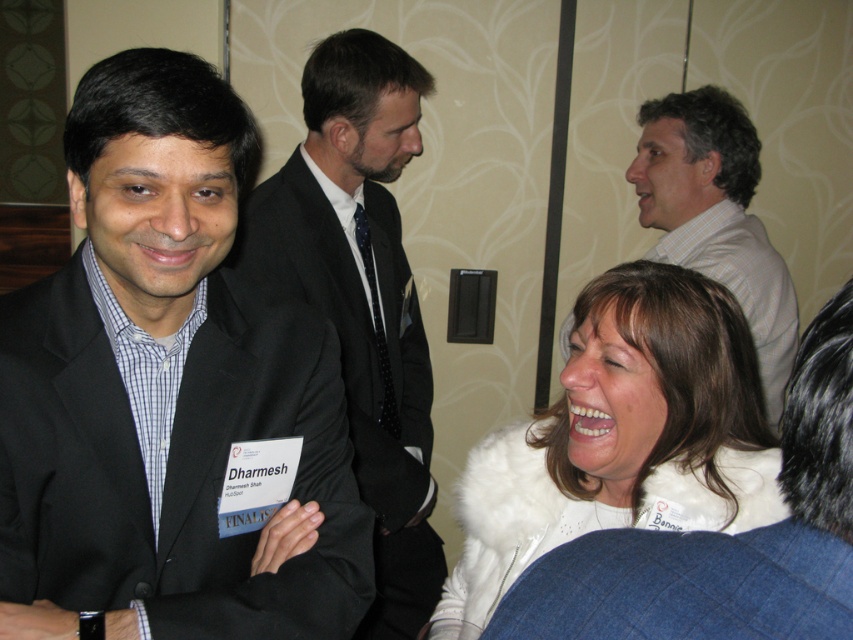
Question: Does white fur coat at lower right have a smaller size compared to white shirt at upper center?

Choices:
 (A) no
 (B) yes

Answer: (B)

Question: Does black matte suit at left lie in front of white shirt at upper center?

Choices:
 (A) yes
 (B) no

Answer: (A)

Question: Which of these objects is positioned farthest from the white shirt at upper center?

Choices:
 (A) black matte suit at left
 (B) dark gray suit at center

Answer: (A)

Question: Which object appears closest to the camera in this image?

Choices:
 (A) white fur coat at lower right
 (B) black matte suit at left
 (C) white shirt at upper center

Answer: (B)

Question: Among these points, which one is nearest to the camera?

Choices:
 (A) (376, 355)
 (B) (767, 260)

Answer: (B)

Question: Is black matte suit at left positioned before dark gray suit at center?

Choices:
 (A) yes
 (B) no

Answer: (A)